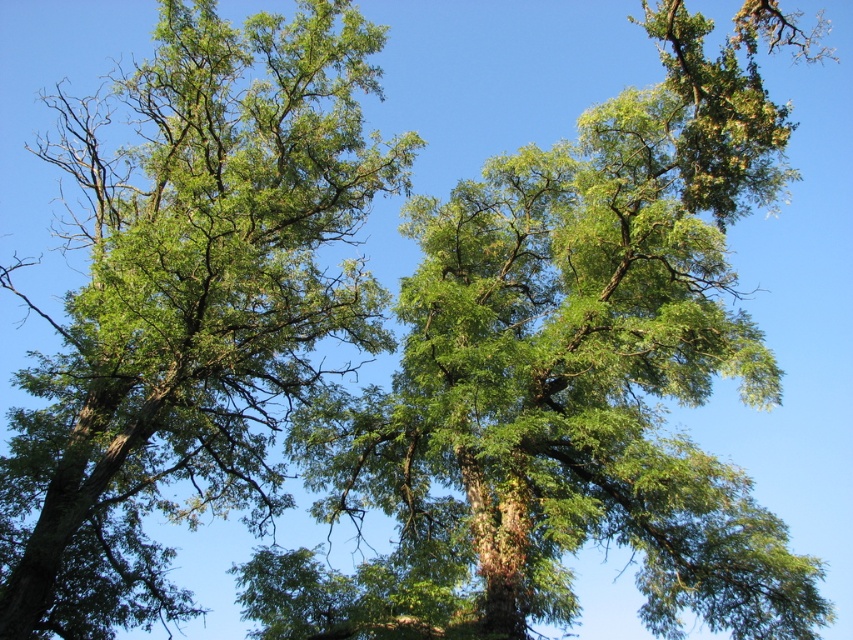
Question: Which point is farther to the camera?

Choices:
 (A) green leafy tree at center
 (B) green leafy oak tree at center

Answer: (A)

Question: From the image, what is the correct spatial relationship of green leafy oak tree at center in relation to green leafy tree at center?

Choices:
 (A) left
 (B) right

Answer: (B)

Question: Is green leafy oak tree at center above green leafy tree at center?

Choices:
 (A) yes
 (B) no

Answer: (B)

Question: Among these objects, which one is farthest from the camera?

Choices:
 (A) green leafy oak tree at center
 (B) green leafy tree at center

Answer: (B)

Question: Among these objects, which one is nearest to the camera?

Choices:
 (A) green leafy oak tree at center
 (B) green leafy tree at center

Answer: (A)

Question: Is green leafy oak tree at center above green leafy tree at center?

Choices:
 (A) yes
 (B) no

Answer: (B)